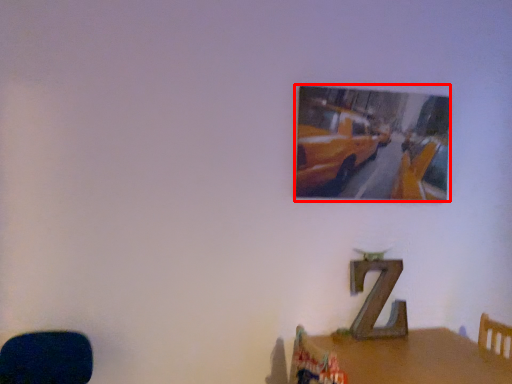
Question: From the image's perspective, where is picture frame (annotated by the red box) located relative to table?

Choices:
 (A) below
 (B) above

Answer: (B)